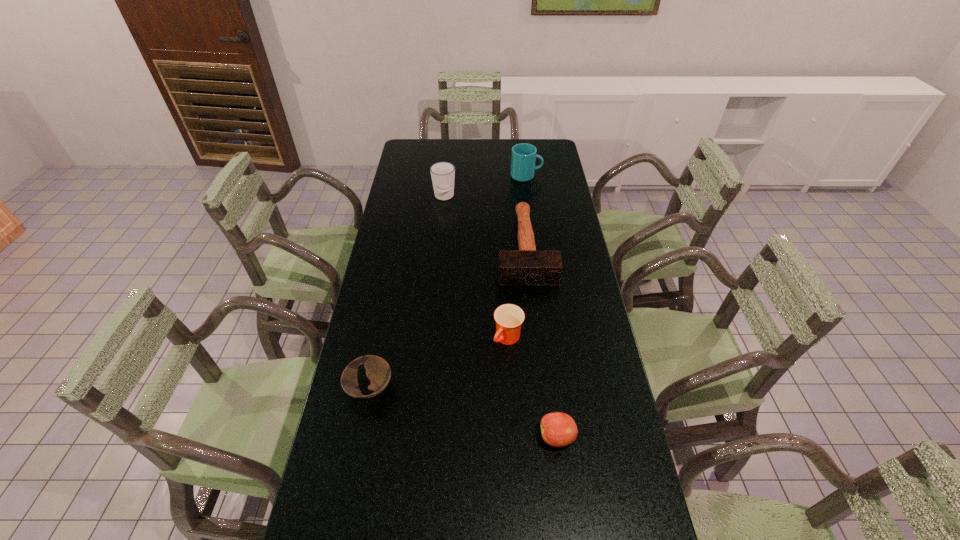
I want to click on free space at the far edge, so click(499, 156).

Image resolution: width=960 pixels, height=540 pixels. Identify the location of vacant space at the left edge. (396, 239).

This screenshot has width=960, height=540. In order to click on blank area at the right edge in this screenshot , I will do `click(615, 507)`.

Where is `vacant space that's between the third farthest object and the apple`? This screenshot has width=960, height=540. vacant space that's between the third farthest object and the apple is located at coordinates (541, 342).

The width and height of the screenshot is (960, 540). Identify the location of free spot between the farthest cup and the leftmost cup. (485, 186).

Where is `empty location between the third farthest object and the bowl`? empty location between the third farthest object and the bowl is located at coordinates (447, 318).

I want to click on free space between the leftmost object and the second cup from left to right, so click(439, 363).

Identify the location of unoccupied position between the apple and the mallet. The width and height of the screenshot is (960, 540). (541, 342).

Find the location of a particular element. The width and height of the screenshot is (960, 540). vacant area that lies between the fourth nearest object and the nearest object is located at coordinates (541, 342).

You are a GUI agent. You are given a task and a screenshot of the screen. Output one action in this format:
    pyautogui.click(x=<x>, y=<y>)
    Task: Click on the free space between the second farthest object and the farthest object
    The image size is (960, 540).
    Given the screenshot: What is the action you would take?
    pyautogui.click(x=485, y=186)